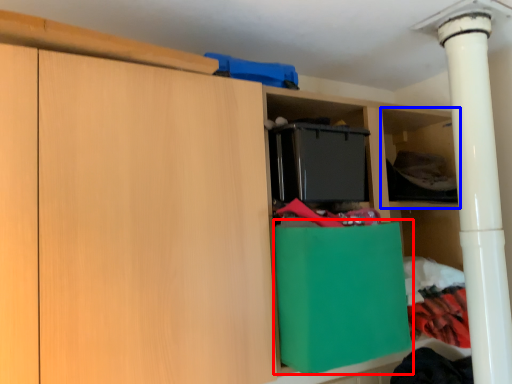
Question: Which object appears closest to the camera in this image, cabinetry (highlighted by a red box) or shelf (highlighted by a blue box)?

Choices:
 (A) cabinetry
 (B) shelf

Answer: (A)